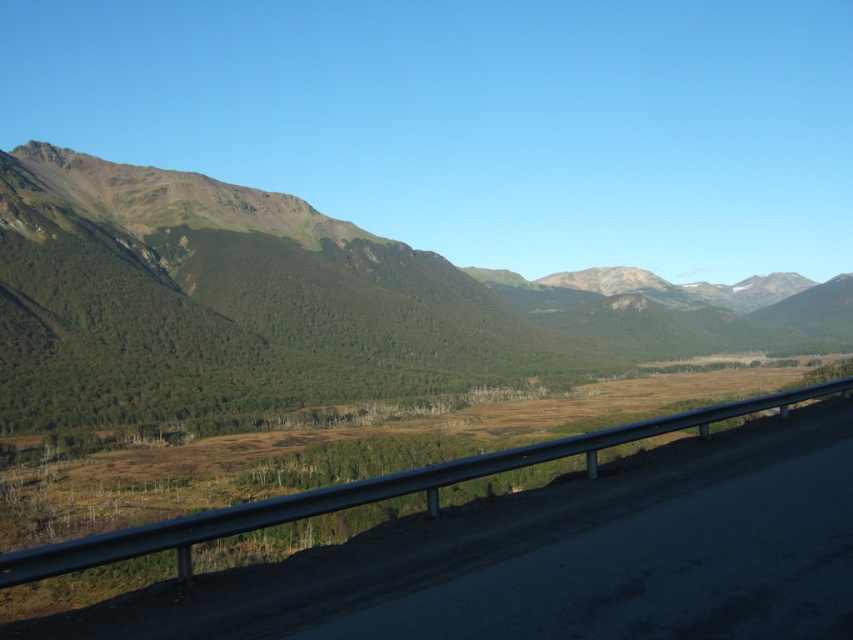
Can you confirm if green grassy mountain at left is smaller than metallic gray highway at center?

No.

Which is above, green grassy mountain at left or metallic gray highway at center?

Positioned higher is green grassy mountain at left.

Describe the element at coordinates (273, 305) in the screenshot. I see `green grassy mountain at left` at that location.

Find the location of a particular element. green grassy mountain at left is located at coordinates (273, 305).